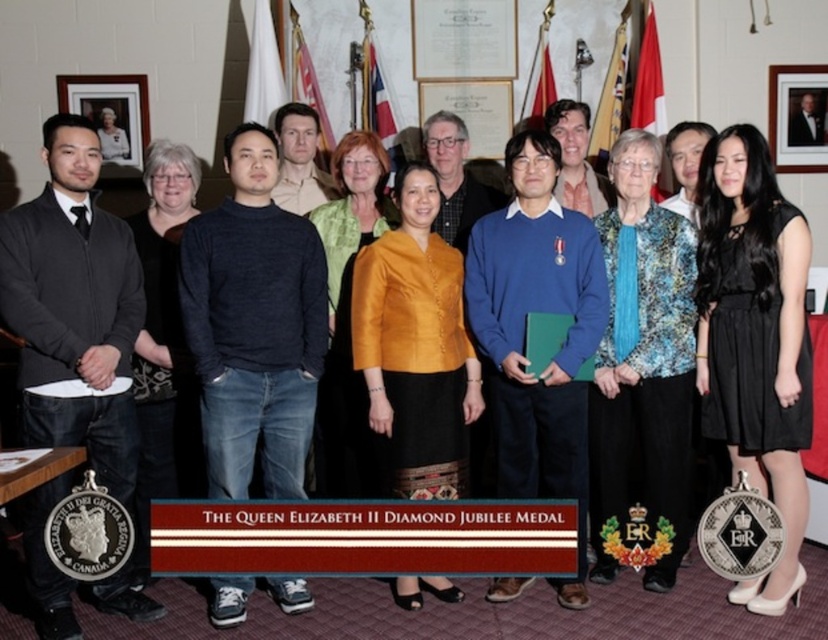
Is dark gray sweater at left positioned in front of wooden picture frame at upper right?

Yes, it is.

Measure the distance between dark gray sweater at left and camera.

3.49 meters

Is point (27, 380) behind point (793, 109)?

No, (27, 380) is in front of (793, 109).

Locate an element on the screen. The image size is (828, 640). dark gray sweater at left is located at coordinates (75, 308).

Can you confirm if dark blue sweater at center is bigger than wooden picture frame at upper right?

Indeed, dark blue sweater at center has a larger size compared to wooden picture frame at upper right.

Which is more to the left, dark blue sweater at center or wooden picture frame at upper right?

From the viewer's perspective, dark blue sweater at center appears more on the left side.

Does point (201, 256) lie behind point (768, 100)?

That is False.

Identify the location of dark blue sweater at center. (254, 324).

Who is positioned more to the left, black satin dress at center or blue sweater at center?

→ Positioned to the left is blue sweater at center.

Is black satin dress at center closer to camera compared to blue sweater at center?

Yes.

Which is behind, point (740, 141) or point (521, 468)?

Point (521, 468)

Where is `black satin dress at center`? The height and width of the screenshot is (640, 828). black satin dress at center is located at coordinates (754, 340).